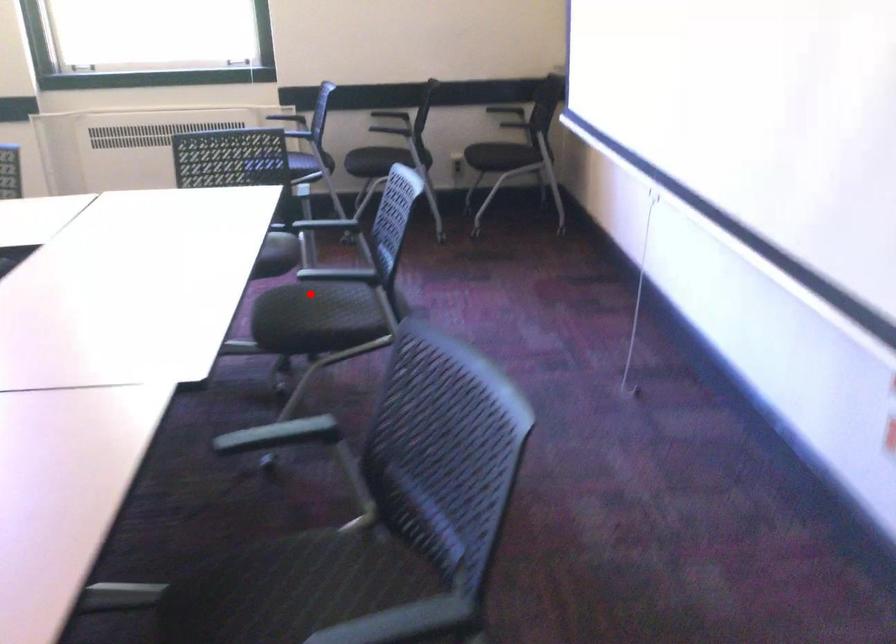
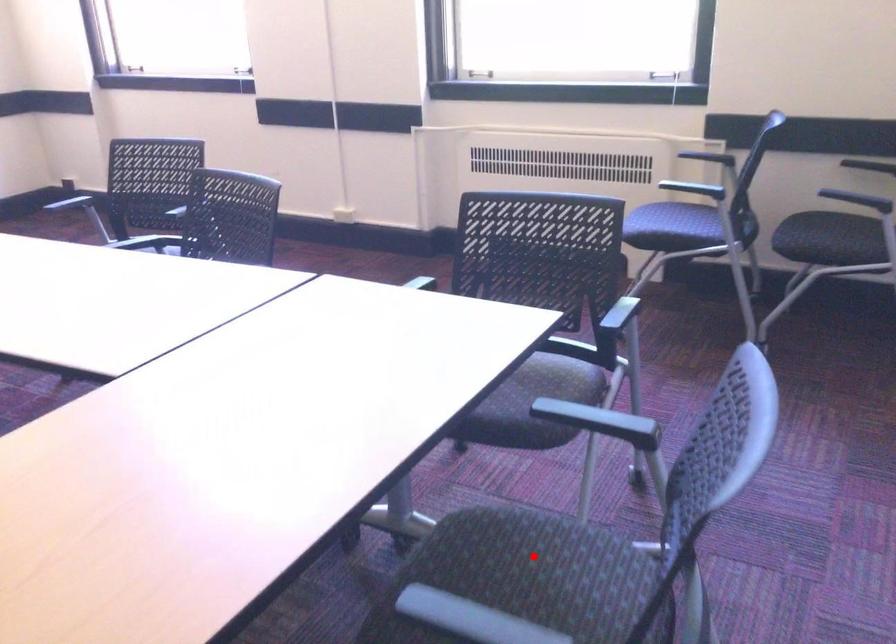
I am providing you with two images of the same scene from different viewpoints. A red point is marked on the first image and another point is marked on the second image. Are the points marked in image1 and image2 representing the same 3D position?

Yes